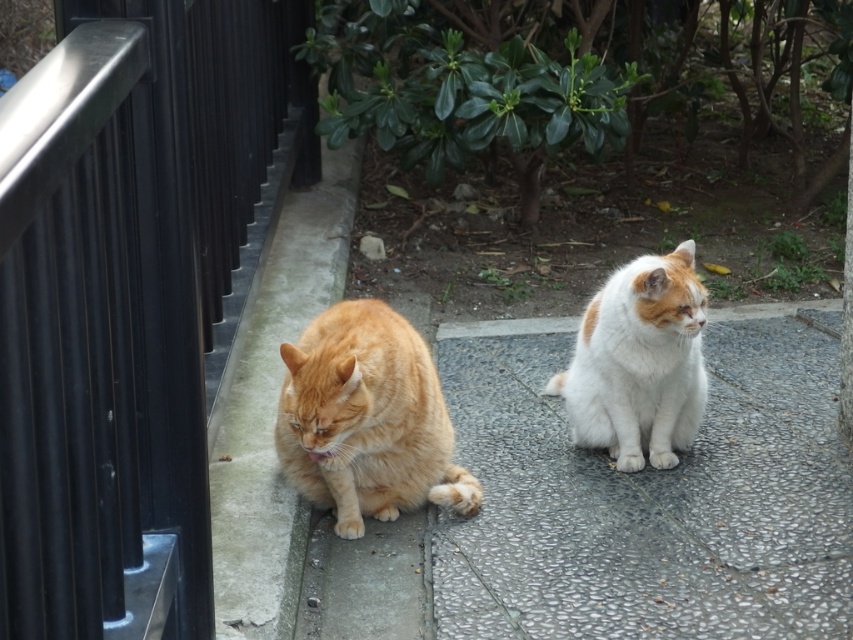
Question: Is black metal rail at left to the right of white fluffy cat at center from the viewer's perspective?

Choices:
 (A) no
 (B) yes

Answer: (A)

Question: Is orange fur cat at left positioned in front of white fluffy cat at center?

Choices:
 (A) no
 (B) yes

Answer: (B)

Question: Which object is positioned closest to the white fluffy cat at center?

Choices:
 (A) orange fur cat at left
 (B) black metal rail at left
 (C) white speckled concrete at center

Answer: (C)

Question: Where is black metal rail at left located in relation to white speckled concrete at center in the image?

Choices:
 (A) above
 (B) below

Answer: (A)

Question: Which object is positioned closest to the white fluffy cat at center?

Choices:
 (A) white speckled concrete at center
 (B) orange fur cat at left
 (C) black metal rail at left

Answer: (A)

Question: Which object is the closest to the orange fur cat at left?

Choices:
 (A) white fluffy cat at center
 (B) white speckled concrete at center
 (C) black metal rail at left

Answer: (B)